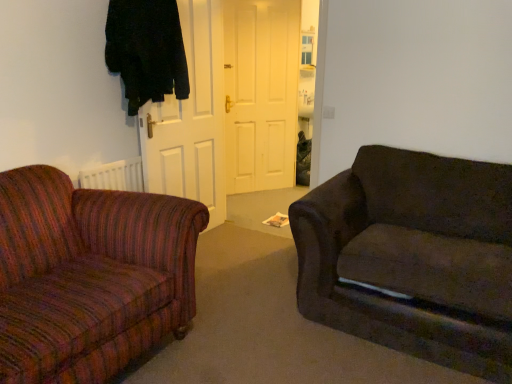
Based on the photo, measure the distance between white matte door at center, acting as the first door starting from the right, and camera.

They are 13.03 feet apart.

What do you see at coordinates (261, 93) in the screenshot? I see `white matte door at center, acting as the first door starting from the right` at bounding box center [261, 93].

I want to click on dark fabric couch at right, so click(413, 256).

Describe the element at coordinates (191, 119) in the screenshot. I see `white matte door at center, marked as the second door in a right-to-left arrangement` at that location.

The width and height of the screenshot is (512, 384). What do you see at coordinates (146, 50) in the screenshot? I see `black fabric coat at upper left` at bounding box center [146, 50].

At what (x,y) coordinates should I click in order to perform the action: click on white matte door at center, acting as the first door starting from the right. Please return your answer as a coordinate pair (x, y). The image size is (512, 384). Looking at the image, I should click on (261, 93).

Based on the photo, is black fabric coat at upper left facing towards dark fabric couch at right?

Yes, black fabric coat at upper left is oriented towards dark fabric couch at right.

What's the angular difference between black fabric coat at upper left and dark fabric couch at right's facing directions?

black fabric coat at upper left and dark fabric couch at right are facing 94.3 degrees away from each other.

Which is more to the left, black fabric coat at upper left or dark fabric couch at right?

black fabric coat at upper left is more to the left.

Considering the sizes of black fabric coat at upper left and dark fabric couch at right in the image, is black fabric coat at upper left wider or thinner than dark fabric couch at right?

In the image, black fabric coat at upper left appears to be more narrow than dark fabric couch at right.

Is point (251, 59) closer to camera compared to point (176, 127)?

No, (251, 59) is further to viewer.

The height and width of the screenshot is (384, 512). In order to click on door behind the white matte door at center, marked as the second door in a right-to-left arrangement in this screenshot , I will do `click(261, 93)`.

Is black fabric coat at upper left looking in the opposite direction of white matte door at center, positioned as the 2th door in front-to-back order?

That's not correct — black fabric coat at upper left is not looking away from white matte door at center, positioned as the 2th door in front-to-back order.

Does black fabric coat at upper left lie in front of white matte door at center, which is the 2th door from left to right?

That is True.

Between black fabric coat at upper left and white matte door at center, acting as the first door starting from the right, which one appears on the right side from the viewer's perspective?

Positioned to the right is white matte door at center, acting as the first door starting from the right.

Is white matte door at center, which ranks as the first door in front-to-back order, outside of white matte door at center, positioned as the 2th door in front-to-back order?

white matte door at center, which ranks as the first door in front-to-back order, lies outside white matte door at center, positioned as the 2th door in front-to-back order,'s area.

Looking at this image, is white matte door at center, marked as the second door in a right-to-left arrangement, facing towards white matte door at center, acting as the first door starting from the right?

No, white matte door at center, marked as the second door in a right-to-left arrangement, is not turned towards white matte door at center, acting as the first door starting from the right.

Considering the sizes of objects white matte door at center, which ranks as the first door in front-to-back order, and white matte door at center, acting as the first door starting from the right, in the image provided, who is shorter, white matte door at center, which ranks as the first door in front-to-back order, or white matte door at center, acting as the first door starting from the right,?

Standing shorter between the two is white matte door at center, which ranks as the first door in front-to-back order.

From a real-world perspective, does white matte door at center, which ranks as the first door in front-to-back order, stand above white matte door at center, acting as the first door starting from the right?

No, from a real-world perspective, white matte door at center, which ranks as the first door in front-to-back order, is not on top of white matte door at center, acting as the first door starting from the right.

Is white matte door at center, positioned as the 2th door in front-to-back order, facing towards dark fabric couch at right?

Yes, white matte door at center, positioned as the 2th door in front-to-back order, is facing dark fabric couch at right.

Is point (290, 154) closer or farther from the camera than point (508, 337)?

Clearly, point (290, 154) is more distant from the camera than point (508, 337).

Would you consider white matte door at center, which is the 2th door from left to right, to be distant from dark fabric couch at right?

Yes, white matte door at center, which is the 2th door from left to right, is far from dark fabric couch at right.

Is white matte door at center, positioned as the 2th door in front-to-back order, a part of dark fabric couch at right?

Definitely not — white matte door at center, positioned as the 2th door in front-to-back order, is not inside dark fabric couch at right.

From a real-world perspective, which is physically above, dark fabric couch at right or white matte door at center, which is the first door in back-to-front order?

white matte door at center, which is the first door in back-to-front order, is physically above.

Considering the sizes of objects dark fabric couch at right and white matte door at center, positioned as the 2th door in front-to-back order, in the image provided, who is wider, dark fabric couch at right or white matte door at center, positioned as the 2th door in front-to-back order,?

dark fabric couch at right is wider.

Is dark fabric couch at right looking in the opposite direction of white matte door at center, which is the 2th door from left to right?

No, dark fabric couch at right's orientation is not away from white matte door at center, which is the 2th door from left to right.

Is white matte door at center, the 2th door positioned from the back, shorter than dark fabric couch at right?

No.

Who is bigger, white matte door at center, the 2th door positioned from the back, or dark fabric couch at right?

dark fabric couch at right is bigger.

From a real-world perspective, is white matte door at center, which ranks as the first door in front-to-back order, on top of dark fabric couch at right?

Yes, from a real-world perspective, white matte door at center, which ranks as the first door in front-to-back order, is over dark fabric couch at right

Is white matte door at center, which ranks as the first door in front-to-back order, positioned in front of dark fabric couch at right?

No, white matte door at center, which ranks as the first door in front-to-back order, is further to the viewer.

The image size is (512, 384). Identify the location of clothing on the left of the dark fabric couch at right. (146, 50).

Image resolution: width=512 pixels, height=384 pixels. Identify the location of door in front of the white matte door at center, positioned as the 2th door in front-to-back order. (191, 119).

Based on their spatial positions, is white matte door at center, positioned as the 2th door in front-to-back order, or white matte door at center, which ranks as the first door in front-to-back order, closer to black fabric coat at upper left?

white matte door at center, which ranks as the first door in front-to-back order, is positioned closer to the anchor black fabric coat at upper left.

Based on their spatial positions, is dark fabric couch at right or white matte door at center, positioned as the 2th door in front-to-back order, further from white matte door at center, the first door viewed from the left?

dark fabric couch at right lies further to white matte door at center, the first door viewed from the left, than the other object.

Considering their positions, is dark fabric couch at right positioned closer to black fabric coat at upper left than white matte door at center, acting as the first door starting from the right?

Based on the image, dark fabric couch at right appears to be nearer to black fabric coat at upper left.

Which object lies nearer to the anchor point black fabric coat at upper left, white matte door at center, which ranks as the first door in front-to-back order, or dark fabric couch at right?

white matte door at center, which ranks as the first door in front-to-back order, is positioned closer to the anchor black fabric coat at upper left.

When comparing their distances from white matte door at center, the 2th door positioned from the back, does white matte door at center, positioned as the 2th door in front-to-back order, or black fabric coat at upper left seem further?

Based on the image, white matte door at center, positioned as the 2th door in front-to-back order, appears to be further to white matte door at center, the 2th door positioned from the back.

Looking at this image, considering their positions, is white matte door at center, the 2th door positioned from the back, positioned further to dark fabric couch at right than black fabric coat at upper left?

Based on the image, black fabric coat at upper left appears to be further to dark fabric couch at right.

Considering their positions, is black fabric coat at upper left positioned closer to white matte door at center, which is the 2th door from left to right, than white matte door at center, the first door viewed from the left?

Based on the image, white matte door at center, the first door viewed from the left, appears to be nearer to white matte door at center, which is the 2th door from left to right.

When comparing their distances from black fabric coat at upper left, does white matte door at center, marked as the second door in a right-to-left arrangement, or white matte door at center, positioned as the 2th door in front-to-back order, seem further?

Based on the image, white matte door at center, positioned as the 2th door in front-to-back order, appears to be further to black fabric coat at upper left.

This screenshot has width=512, height=384. Find the location of `clothing between dark fabric couch at right and white matte door at center, which is the 2th door from left to right, from front to back`. clothing between dark fabric couch at right and white matte door at center, which is the 2th door from left to right, from front to back is located at coordinates (146, 50).

Locate an element on the screen. The width and height of the screenshot is (512, 384). door positioned between black fabric coat at upper left and white matte door at center, which is the 2th door from left to right, from near to far is located at coordinates (191, 119).

In order to click on door between dark fabric couch at right and white matte door at center, which is the 2th door from left to right, from front to back in this screenshot , I will do 191,119.